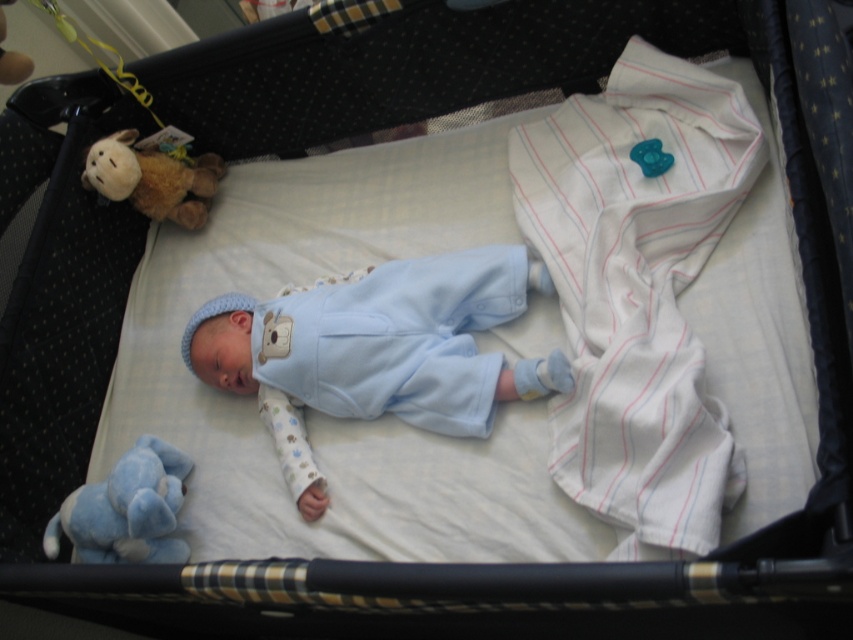
Measure the distance between matte blue onesie at center and soft plush toy at lower left.

matte blue onesie at center and soft plush toy at lower left are 12.11 inches apart.

Image resolution: width=853 pixels, height=640 pixels. What do you see at coordinates (378, 349) in the screenshot?
I see `matte blue onesie at center` at bounding box center [378, 349].

Between point (508, 376) and point (160, 442), which one is positioned behind?

The point (160, 442) is behind.

You are a GUI agent. You are given a task and a screenshot of the screen. Output one action in this format:
    pyautogui.click(x=<x>, y=<y>)
    Task: Click on the matte blue onesie at center
    
    Given the screenshot: What is the action you would take?
    pyautogui.click(x=378, y=349)

Which is above, matte blue onesie at center or soft brown plush toy at upper left?

soft brown plush toy at upper left

Does matte blue onesie at center have a greater height compared to soft brown plush toy at upper left?

Yes, matte blue onesie at center is taller than soft brown plush toy at upper left.

Is point (409, 365) positioned behind point (155, 163)?

No, (409, 365) is in front of (155, 163).

Identify the location of matte blue onesie at center. This screenshot has width=853, height=640. (378, 349).

Which is behind, point (125, 499) or point (170, 161)?

Point (170, 161)

The height and width of the screenshot is (640, 853). Identify the location of soft plush toy at lower left. (126, 509).